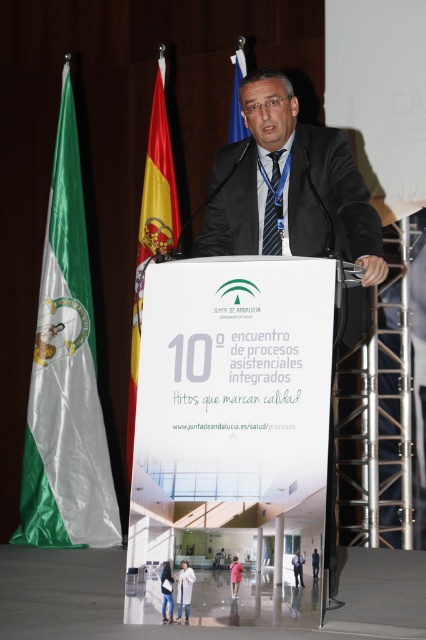
Who is higher up, blue striped tie at center or black suit at center?

Positioned higher is blue striped tie at center.

Which is in front, point (275, 241) or point (293, 573)?

Point (293, 573) is more forward.

I want to click on blue striped tie at center, so click(273, 205).

The image size is (426, 640). Find the location of `blue striped tie at center`. blue striped tie at center is located at coordinates (273, 205).

Consider the image. Measure the distance between blue fabric flag at upper center and matte black suit at center.

3.48 meters

Between blue fabric flag at upper center and matte black suit at center, which one has less height?

With less height is matte black suit at center.

The height and width of the screenshot is (640, 426). What are the coordinates of `blue fabric flag at upper center` in the screenshot? It's located at (236, 96).

You are a GUI agent. You are given a task and a screenshot of the screen. Output one action in this format:
    pyautogui.click(x=<x>, y=<y>)
    Task: Click on the blue fabric flag at upper center
    
    Given the screenshot: What is the action you would take?
    pyautogui.click(x=236, y=96)

Which of these two, blue striped tie at center or blue fabric flag at upper center, stands shorter?

blue striped tie at center is shorter.

Who is more distant from viewer, [282,196] or [244,58]?

Point [244,58]

Is point (271, 168) positioned behind point (239, 68)?

No, it is in front of (239, 68).

Find the location of `blue striped tie at center`. blue striped tie at center is located at coordinates (273, 205).